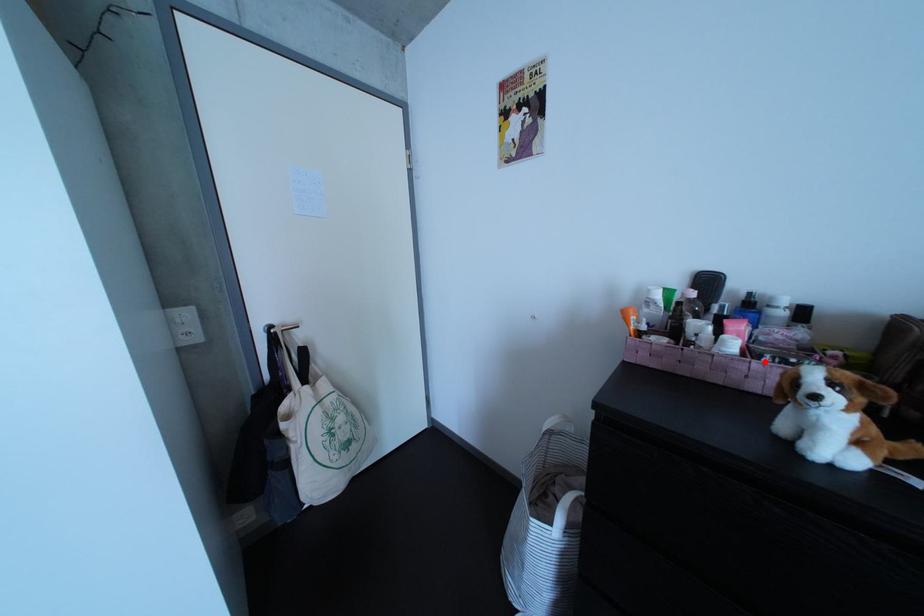
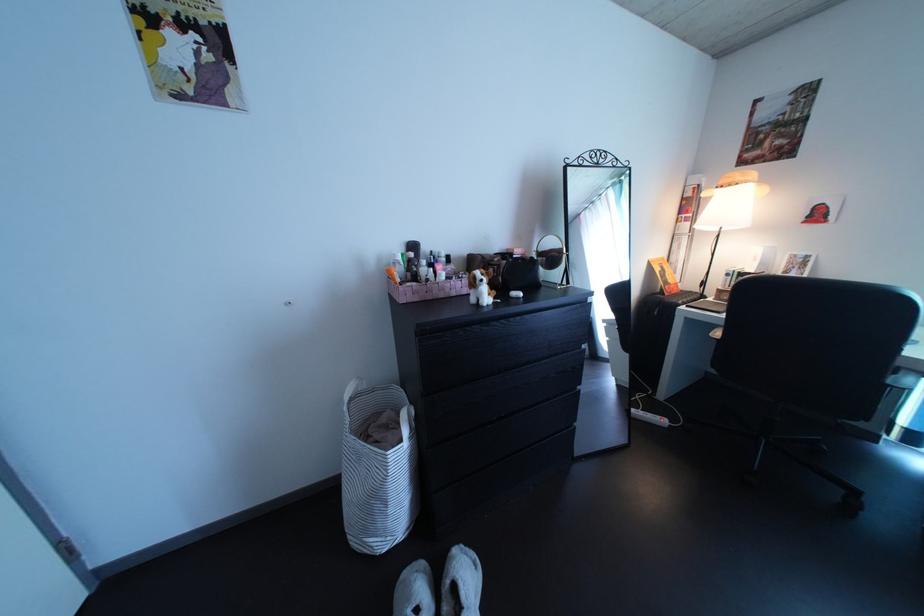
Find the pixel in the second image that matches the highlighted location in the first image.

(464, 286)